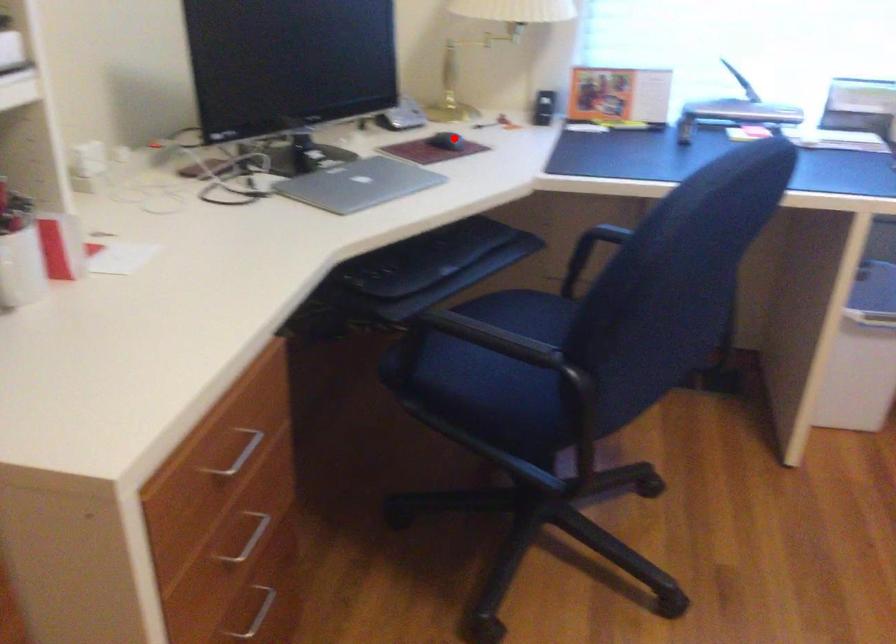
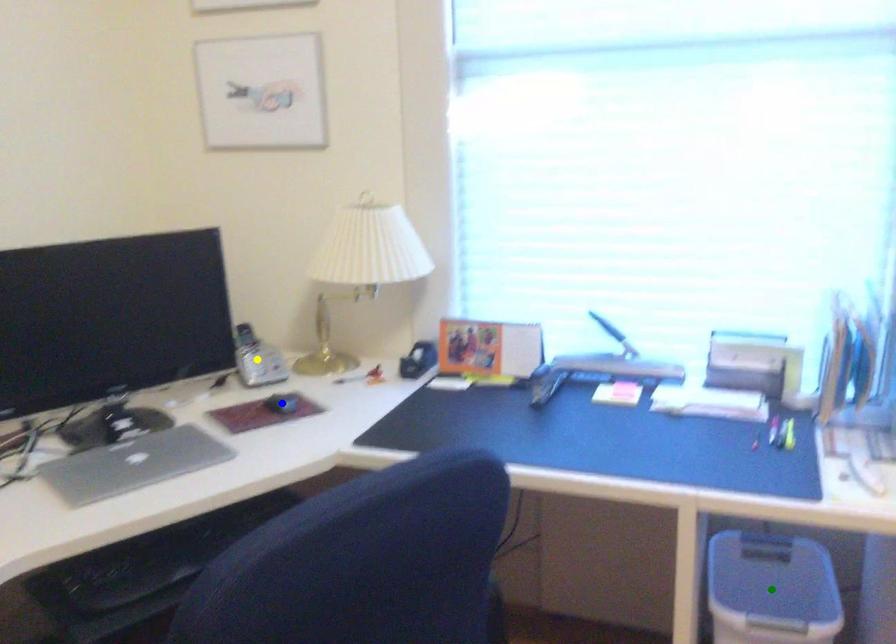
Question: I am providing you with two images of the same scene from different viewpoints. A red point is marked on the first image. You are given multiple points on the second image. Can you choose the point in image 2 that corresponds to the point in image 1?

Choices:
 (A) green point
 (B) blue point
 (C) yellow point

Answer: (B)